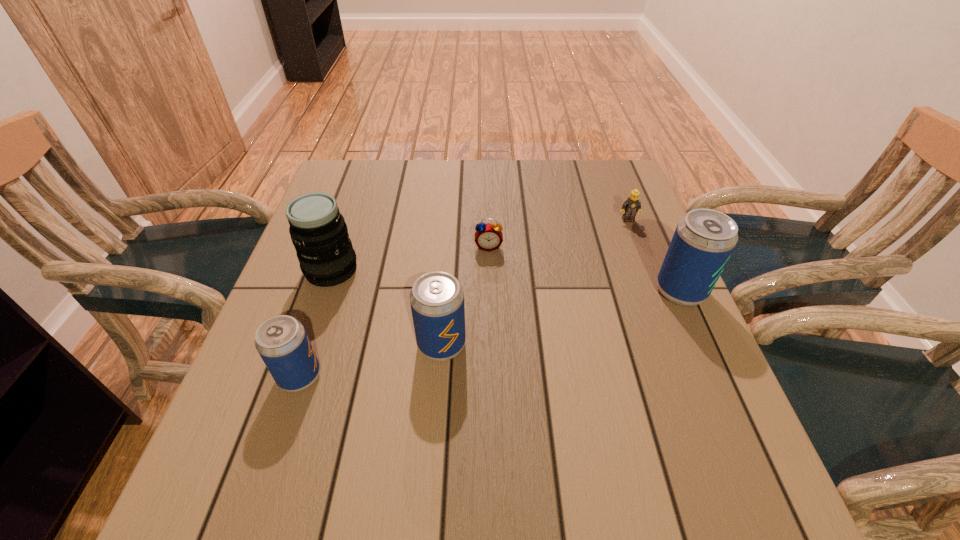
Locate an element on the screen. This screenshot has height=540, width=960. free space that satisfies the following two spatial constraints: 1. on the front side of the fourth tallest object; 2. on the right side of the telephoto lens is located at coordinates (296, 376).

Where is `free space that satisfies the following two spatial constraints: 1. on the front-facing side of the alarm clock; 2. on the right side of the rightmost beer can`? This screenshot has width=960, height=540. free space that satisfies the following two spatial constraints: 1. on the front-facing side of the alarm clock; 2. on the right side of the rightmost beer can is located at coordinates click(x=490, y=291).

Where is `vacant space that satisfies the following two spatial constraints: 1. on the back side of the farthest beer can; 2. on the left side of the leftmost beer can`? The height and width of the screenshot is (540, 960). vacant space that satisfies the following two spatial constraints: 1. on the back side of the farthest beer can; 2. on the left side of the leftmost beer can is located at coordinates (328, 291).

The width and height of the screenshot is (960, 540). I want to click on free location that satisfies the following two spatial constraints: 1. on the front-facing side of the rightmost beer can; 2. on the right side of the third object from right to left, so click(490, 291).